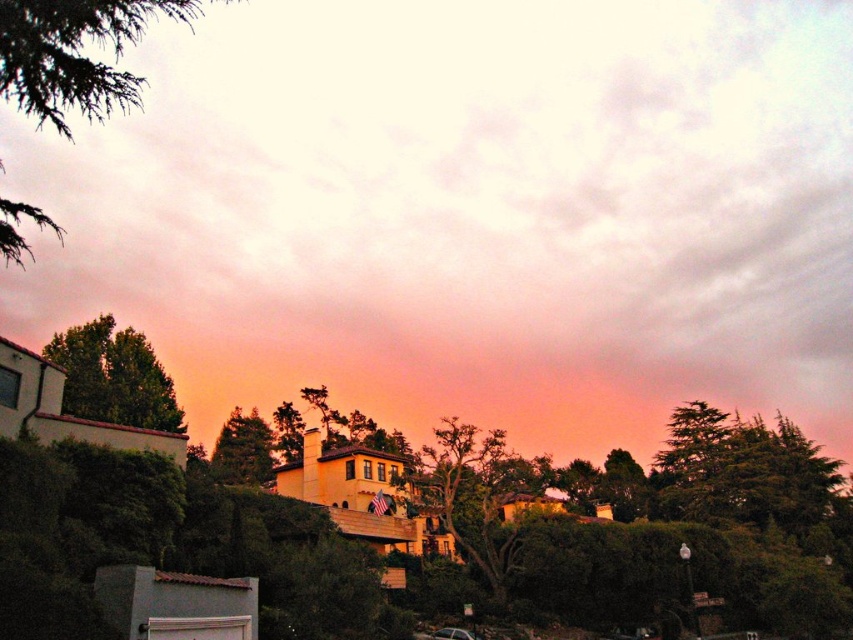
Who is lower down, green leafy tree at upper left or green leafy tree at left?

green leafy tree at left

Is green leafy tree at upper left below green leafy tree at left?

Incorrect, green leafy tree at upper left is not positioned below green leafy tree at left.

Does point (62, 76) come in front of point (141, 404)?

Yes, it is in front of point (141, 404).

What are the coordinates of `green leafy tree at upper left` in the screenshot? It's located at (76, 54).

Where is `pink matte cloud at upper center`? pink matte cloud at upper center is located at coordinates (468, 212).

Measure the distance between point (544, 212) and camera.

Point (544, 212) and camera are 1175.73 feet apart from each other.

The width and height of the screenshot is (853, 640). What are the coordinates of `pink matte cloud at upper center` in the screenshot? It's located at (468, 212).

Does pink matte cloud at upper center have a lesser height compared to green leafy tree at left?

No, pink matte cloud at upper center is not shorter than green leafy tree at left.

Who is lower down, pink matte cloud at upper center or green leafy tree at left?

green leafy tree at left is lower down.

Which is behind, point (305, 136) or point (80, 410)?

Point (305, 136)

The height and width of the screenshot is (640, 853). I want to click on pink matte cloud at upper center, so click(x=468, y=212).